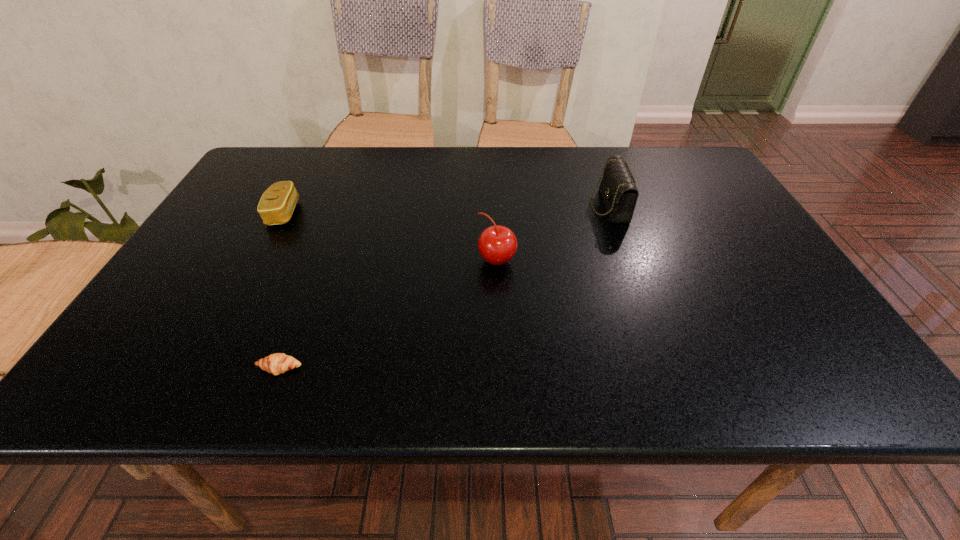
I want to click on vacant area that lies between the second object from right to left and the rightmost object, so click(553, 233).

Where is `empty location between the cherry and the rightmost object`? empty location between the cherry and the rightmost object is located at coordinates (553, 233).

Locate an element on the screen. free point between the pastry and the taller clutch bag is located at coordinates (444, 287).

This screenshot has height=540, width=960. Find the location of `vacant space in between the nearest object and the cherry`. vacant space in between the nearest object and the cherry is located at coordinates (389, 314).

Find the location of a particular element. The image size is (960, 540). free spot between the third object from left to right and the taller clutch bag is located at coordinates (553, 233).

At what (x,y) coordinates should I click in order to perform the action: click on empty space that is in between the rightmost object and the left clutch bag. Please return your answer as a coordinate pair (x, y). This screenshot has height=540, width=960. Looking at the image, I should click on (446, 209).

The width and height of the screenshot is (960, 540). Find the location of `free space between the second object from right to left and the pastry`. free space between the second object from right to left and the pastry is located at coordinates (389, 314).

Where is `free spot between the shortest object and the taller clutch bag`? Image resolution: width=960 pixels, height=540 pixels. free spot between the shortest object and the taller clutch bag is located at coordinates (444, 287).

Where is `vacant point located between the left clutch bag and the cherry`? vacant point located between the left clutch bag and the cherry is located at coordinates (391, 237).

Image resolution: width=960 pixels, height=540 pixels. I want to click on free space between the second object from right to left and the left clutch bag, so click(391, 237).